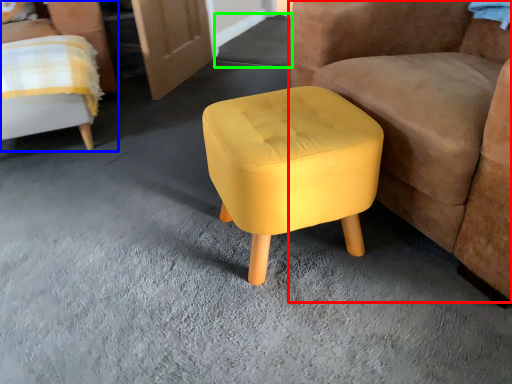
Question: Estimate the real-world distances between objects in this image. Which object is closer to chair (highlighted by a red box), chair (highlighted by a blue box) or concrete (highlighted by a green box)?

Choices:
 (A) chair
 (B) concrete

Answer: (A)